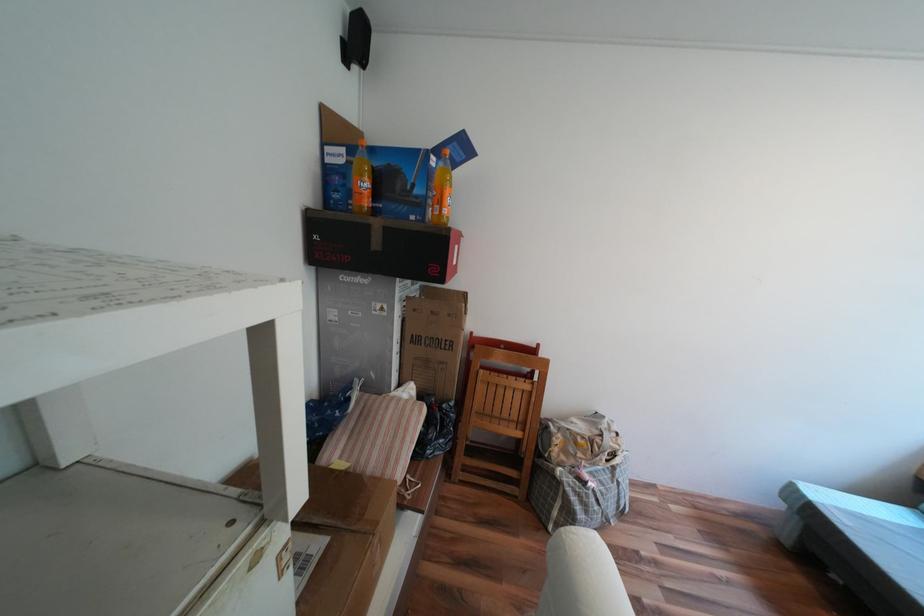
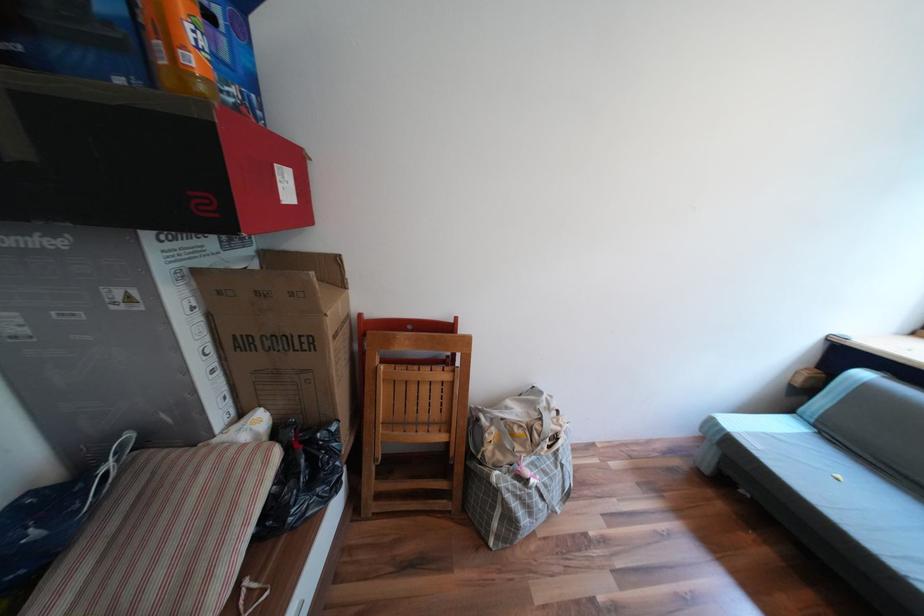
Find the pixel in the second image that matches (408,341) in the first image.

(219, 349)